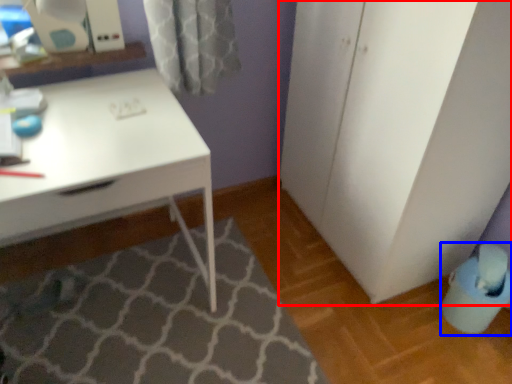
Question: Which object appears closest to the camera in this image, file cabinet (highlighted by a red box) or swivel chair (highlighted by a blue box)?

Choices:
 (A) file cabinet
 (B) swivel chair

Answer: (A)